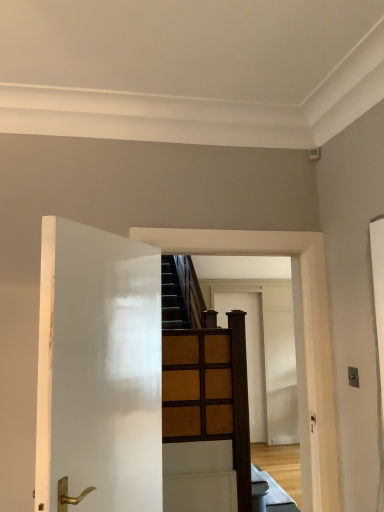
Describe the element at coordinates (98, 370) in the screenshot. The width and height of the screenshot is (384, 512). I see `white glossy door at left, which ranks as the 1th door in front-to-back order` at that location.

At what (x,y) coordinates should I click in order to perform the action: click on white glossy door at left, which ranks as the first door in left-to-right order. Please return your answer as a coordinate pair (x, y). The image size is (384, 512). Looking at the image, I should click on (98, 370).

What do you see at coordinates (249, 354) in the screenshot?
I see `brown wooden door at center, positioned as the second door in left-to-right order` at bounding box center [249, 354].

The width and height of the screenshot is (384, 512). Identify the location of brown wooden door at center, the 1th door viewed from the right. (249, 354).

What is the approximate width of brown wooden door at center, arranged as the 1th door when viewed from the back?

The width of brown wooden door at center, arranged as the 1th door when viewed from the back, is 1.96 inches.

The width and height of the screenshot is (384, 512). What are the coordinates of `white glossy door at left, the second door in the right-to-left sequence` in the screenshot? It's located at (98, 370).

Which object is positioned more to the left, brown wooden door at center, arranged as the 1th door when viewed from the back, or white glossy door at left, which is counted as the second door, starting from the back?

Positioned to the left is white glossy door at left, which is counted as the second door, starting from the back.

Based on the photo, which is behind, brown wooden door at center, arranged as the 1th door when viewed from the back, or white glossy door at left, which ranks as the 1th door in front-to-back order?

brown wooden door at center, arranged as the 1th door when viewed from the back, is behind.

Is point (255, 406) more distant than point (143, 452)?

That is True.

From the image's perspective, would you say brown wooden door at center, the second door positioned from the front, is positioned over white glossy door at left, which ranks as the first door in left-to-right order?

Incorrect, from the image's perspective, brown wooden door at center, the second door positioned from the front, is lower than white glossy door at left, which ranks as the first door in left-to-right order.

From a real-world perspective, who is located lower, brown wooden door at center, the second door positioned from the front, or white glossy door at left, which ranks as the first door in left-to-right order?

brown wooden door at center, the second door positioned from the front, is physically lower.

Considering the sizes of brown wooden door at center, positioned as the second door in left-to-right order, and white glossy door at left, which ranks as the first door in left-to-right order, in the image, is brown wooden door at center, positioned as the second door in left-to-right order, wider or thinner than white glossy door at left, which ranks as the first door in left-to-right order,?

In the image, brown wooden door at center, positioned as the second door in left-to-right order, appears to be more narrow than white glossy door at left, which ranks as the first door in left-to-right order.

Can you confirm if brown wooden door at center, the second door positioned from the front, is shorter than white glossy door at left, which ranks as the 1th door in front-to-back order?

Incorrect, the height of brown wooden door at center, the second door positioned from the front, does not fall short of that of white glossy door at left, which ranks as the 1th door in front-to-back order.

Which of these two, brown wooden door at center, positioned as the second door in left-to-right order, or white glossy door at left, the second door in the right-to-left sequence, is bigger?

Bigger between the two is white glossy door at left, the second door in the right-to-left sequence.

Is white glossy door at left, which ranks as the 1th door in front-to-back order, a part of brown wooden door at center, positioned as the second door in left-to-right order?

No.

Is brown wooden door at center, arranged as the 1th door when viewed from the back, not near white glossy door at left, which is counted as the second door, starting from the back?

brown wooden door at center, arranged as the 1th door when viewed from the back, is positioned a significant distance from white glossy door at left, which is counted as the second door, starting from the back.

Could you tell me if brown wooden door at center, positioned as the second door in left-to-right order, is facing white glossy door at left, which ranks as the first door in left-to-right order?

No, brown wooden door at center, positioned as the second door in left-to-right order, is not oriented towards white glossy door at left, which ranks as the first door in left-to-right order.

Measure the distance between brown wooden door at center, the second door positioned from the front, and white glossy door at left, which ranks as the first door in left-to-right order.

brown wooden door at center, the second door positioned from the front, is 4.92 meters from white glossy door at left, which ranks as the first door in left-to-right order.

Locate an element on the screen. This screenshot has width=384, height=512. door on the left of brown wooden door at center, arranged as the 1th door when viewed from the back is located at coordinates (98, 370).

Is white glossy door at left, which is counted as the second door, starting from the back, to the left of brown wooden door at center, the 1th door viewed from the right, from the viewer's perspective?

Yes.

Between white glossy door at left, the second door in the right-to-left sequence, and brown wooden door at center, positioned as the second door in left-to-right order, which one is positioned behind?

brown wooden door at center, positioned as the second door in left-to-right order, is more distant.

Which is closer, (57, 369) or (258, 398)?

Point (57, 369)

From the picture: From the image's perspective, who appears lower, white glossy door at left, the second door in the right-to-left sequence, or brown wooden door at center, positioned as the second door in left-to-right order?

brown wooden door at center, positioned as the second door in left-to-right order, from the image's perspective.

From a real-world perspective, between white glossy door at left, which ranks as the first door in left-to-right order, and brown wooden door at center, the 1th door viewed from the right, who is vertically lower?

brown wooden door at center, the 1th door viewed from the right.

Between white glossy door at left, which ranks as the 1th door in front-to-back order, and brown wooden door at center, positioned as the second door in left-to-right order, which one has larger width?

Wider between the two is white glossy door at left, which ranks as the 1th door in front-to-back order.

Is white glossy door at left, which is counted as the second door, starting from the back, taller or shorter than brown wooden door at center, positioned as the second door in left-to-right order?

Clearly, white glossy door at left, which is counted as the second door, starting from the back, is shorter compared to brown wooden door at center, positioned as the second door in left-to-right order.

Between white glossy door at left, which ranks as the 1th door in front-to-back order, and brown wooden door at center, positioned as the second door in left-to-right order, which one has larger size?

With larger size is white glossy door at left, which ranks as the 1th door in front-to-back order.

Choose the correct answer: Is white glossy door at left, which is counted as the second door, starting from the back, inside brown wooden door at center, arranged as the 1th door when viewed from the back, or outside it?

white glossy door at left, which is counted as the second door, starting from the back, is not enclosed by brown wooden door at center, arranged as the 1th door when viewed from the back.

Is white glossy door at left, which ranks as the 1th door in front-to-back order, far away from brown wooden door at center, the second door positioned from the front?

Absolutely, white glossy door at left, which ranks as the 1th door in front-to-back order, is distant from brown wooden door at center, the second door positioned from the front.

Is white glossy door at left, the second door in the right-to-left sequence, oriented away from brown wooden door at center, arranged as the 1th door when viewed from the back?

white glossy door at left, the second door in the right-to-left sequence, is not turned away from brown wooden door at center, arranged as the 1th door when viewed from the back.

How many degrees apart are the facing directions of white glossy door at left, which ranks as the 1th door in front-to-back order, and brown wooden door at center, positioned as the second door in left-to-right order?

They differ by 59.9 degrees in their facing directions.

Identify the location of door that appears above the brown wooden door at center, the 1th door viewed from the right (from the image's perspective). This screenshot has height=512, width=384. (98, 370).

Identify the location of door above the brown wooden door at center, the second door positioned from the front (from the image's perspective). Image resolution: width=384 pixels, height=512 pixels. (98, 370).

The height and width of the screenshot is (512, 384). Find the location of `door behind the white glossy door at left, which is counted as the second door, starting from the back`. door behind the white glossy door at left, which is counted as the second door, starting from the back is located at coordinates (249, 354).